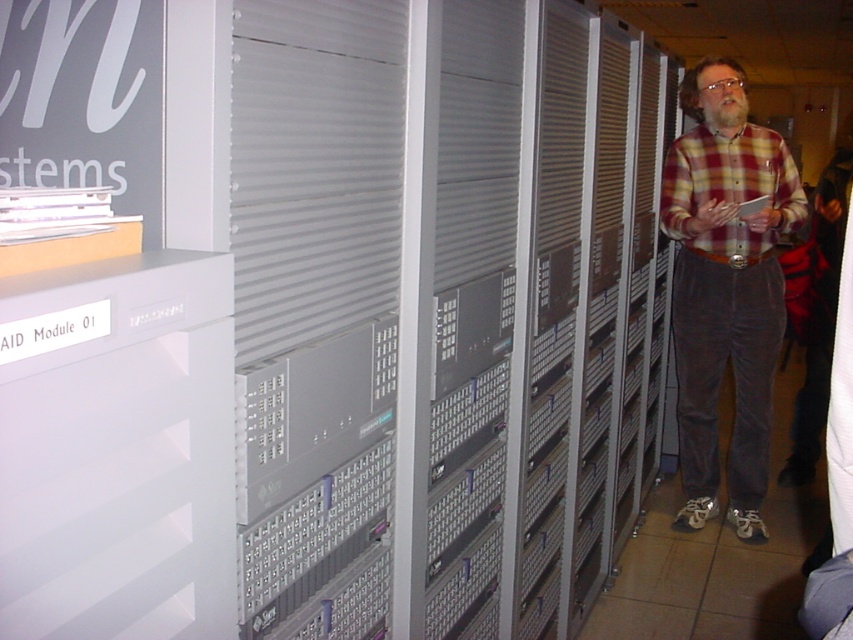
Can you confirm if plaid flannel shirt at center is bigger than plaid cotton shirt at right?

Correct, plaid flannel shirt at center is larger in size than plaid cotton shirt at right.

Locate an element on the screen. The image size is (853, 640). plaid flannel shirt at center is located at coordinates (724, 288).